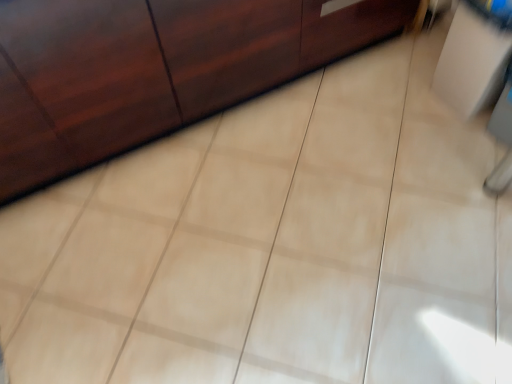
Describe the element at coordinates (152, 69) in the screenshot. I see `matte wood cabinet at upper left` at that location.

Where is `matte wood cabinet at upper left`? This screenshot has width=512, height=384. matte wood cabinet at upper left is located at coordinates (152, 69).

The image size is (512, 384). What are the coordinates of `white glossy cabinet at upper right` in the screenshot? It's located at (473, 59).

This screenshot has width=512, height=384. Describe the element at coordinates (473, 59) in the screenshot. I see `white glossy cabinet at upper right` at that location.

What are the coordinates of `matte wood cabinet at upper left` in the screenshot? It's located at (152, 69).

Can you confirm if matte wood cabinet at upper left is positioned to the left of white glossy cabinet at upper right?

Yes, matte wood cabinet at upper left is to the left of white glossy cabinet at upper right.

Does matte wood cabinet at upper left come in front of white glossy cabinet at upper right?

Yes, matte wood cabinet at upper left is closer to the viewer.

Does point (38, 156) come closer to viewer compared to point (470, 0)?

Yes, point (38, 156) is in front of point (470, 0).

From the image's perspective, which object appears higher, matte wood cabinet at upper left or white glossy cabinet at upper right?

matte wood cabinet at upper left.

From a real-world perspective, is matte wood cabinet at upper left below white glossy cabinet at upper right?

Actually, matte wood cabinet at upper left is physically above white glossy cabinet at upper right in the real world.

Looking at their sizes, would you say matte wood cabinet at upper left is wider or thinner than white glossy cabinet at upper right?

matte wood cabinet at upper left is wider than white glossy cabinet at upper right.

Which of these two, matte wood cabinet at upper left or white glossy cabinet at upper right, stands shorter?

With less height is white glossy cabinet at upper right.

Considering the sizes of objects matte wood cabinet at upper left and white glossy cabinet at upper right in the image provided, who is smaller, matte wood cabinet at upper left or white glossy cabinet at upper right?

With smaller size is white glossy cabinet at upper right.

Do you think matte wood cabinet at upper left is within white glossy cabinet at upper right, or outside of it?

The correct answer is: outside.

Are matte wood cabinet at upper left and white glossy cabinet at upper right making contact?

No, matte wood cabinet at upper left is not in contact with white glossy cabinet at upper right.

Is matte wood cabinet at upper left facing towards white glossy cabinet at upper right?

Yes, matte wood cabinet at upper left is aimed at white glossy cabinet at upper right.

Locate an element on the screen. The width and height of the screenshot is (512, 384). vanity below the matte wood cabinet at upper left (from a real-world perspective) is located at coordinates (473, 59).

Which is more to the left, white glossy cabinet at upper right or matte wood cabinet at upper left?

From the viewer's perspective, matte wood cabinet at upper left appears more on the left side.

Relative to matte wood cabinet at upper left, is white glossy cabinet at upper right in front or behind?

white glossy cabinet at upper right is behind matte wood cabinet at upper left.

Considering the positions of point (446, 61) and point (85, 78), is point (446, 61) closer or farther from the camera than point (85, 78)?

Point (446, 61) appears to be farther away from the viewer than point (85, 78).

From the image's perspective, would you say white glossy cabinet at upper right is shown under matte wood cabinet at upper left?

Yes, from the image's perspective, white glossy cabinet at upper right is beneath matte wood cabinet at upper left.

From a real-world perspective, which is physically above, white glossy cabinet at upper right or matte wood cabinet at upper left?

In real-world perspective, matte wood cabinet at upper left is above.

Considering the relative sizes of white glossy cabinet at upper right and matte wood cabinet at upper left in the image provided, is white glossy cabinet at upper right wider than matte wood cabinet at upper left?

No, white glossy cabinet at upper right is not wider than matte wood cabinet at upper left.

Who is taller, white glossy cabinet at upper right or matte wood cabinet at upper left?

Standing taller between the two is matte wood cabinet at upper left.

Considering the relative sizes of white glossy cabinet at upper right and matte wood cabinet at upper left in the image provided, is white glossy cabinet at upper right bigger than matte wood cabinet at upper left?

Actually, white glossy cabinet at upper right might be smaller than matte wood cabinet at upper left.

Is white glossy cabinet at upper right inside the boundaries of matte wood cabinet at upper left, or outside?

white glossy cabinet at upper right exists outside the volume of matte wood cabinet at upper left.

Is white glossy cabinet at upper right next to matte wood cabinet at upper left and touching it?

No, white glossy cabinet at upper right is not beside matte wood cabinet at upper left.

Is white glossy cabinet at upper right oriented away from matte wood cabinet at upper left?

No, white glossy cabinet at upper right is not facing the opposite direction of matte wood cabinet at upper left.

Find the location of a particular element. This screenshot has width=512, height=384. vanity on the right of matte wood cabinet at upper left is located at coordinates (473, 59).

I want to click on furniture that is on the left side of white glossy cabinet at upper right, so click(152, 69).

This screenshot has height=384, width=512. I want to click on furniture above the white glossy cabinet at upper right (from a real-world perspective), so click(x=152, y=69).